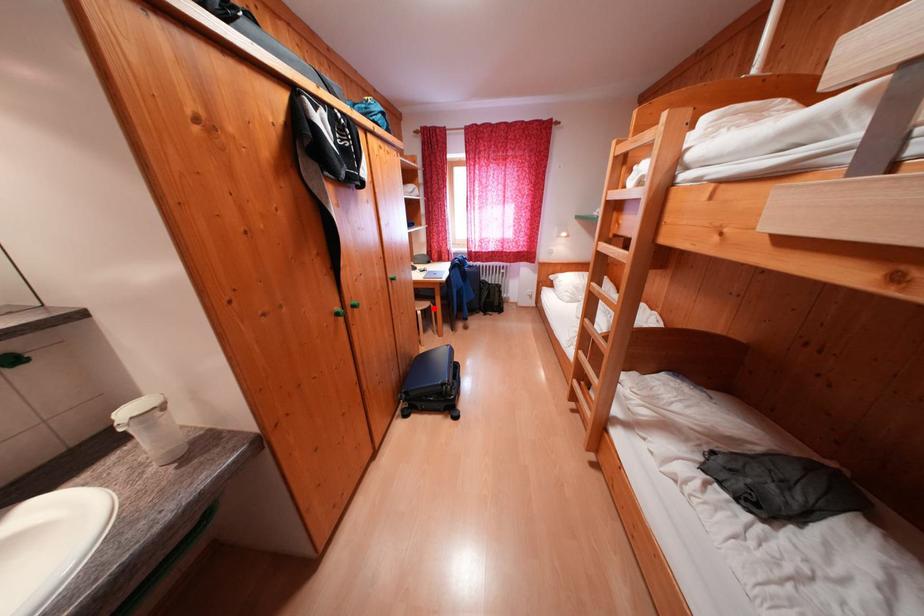
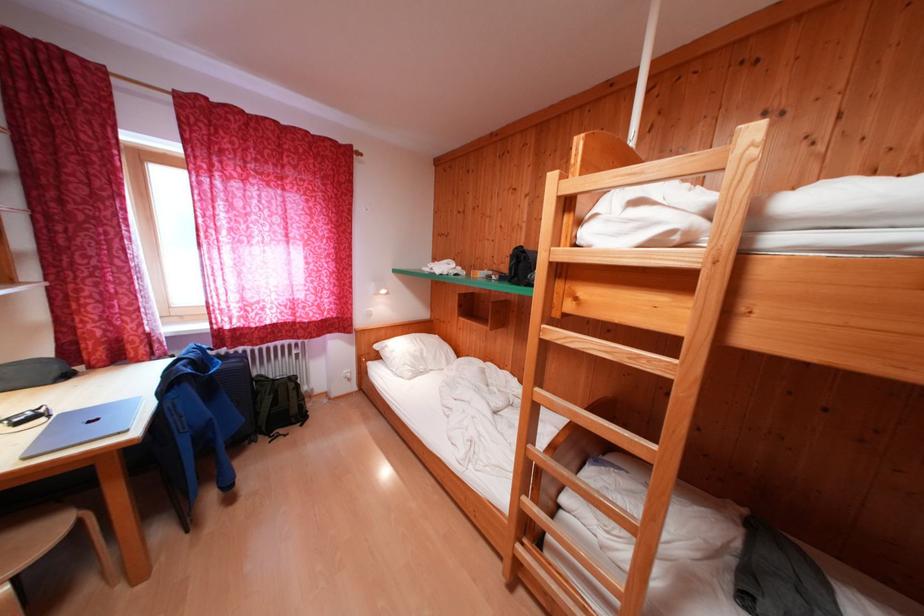
Question: I am providing you with two images of the same scene from different viewpoints. Given a red point in image1, look at the same physical point in image2. Is it:

Choices:
 (A) Closer to the viewpoint
 (B) Farther from the viewpoint

Answer: (B)